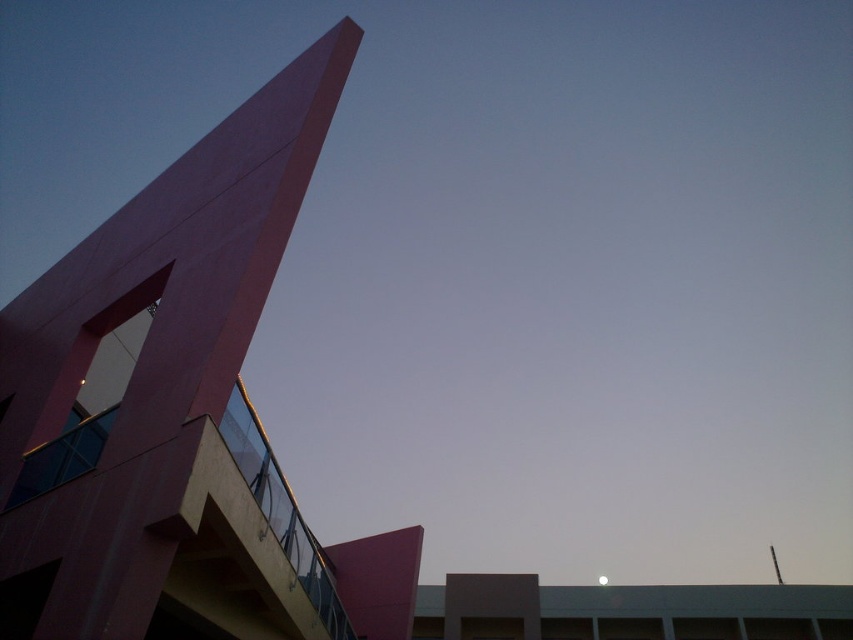
You are an architect evaluating the design of the building. You notice the matte pink tower at upper left and the white glossy moon at upper center. Which object takes up more space in the image?

The white glossy moon at upper center takes up more space in the image because it is larger than the matte pink tower at upper left.

You are standing at the entrance of the building and want to locate the matte pink tower at upper left. According to the coordinates provided, where should you look relative to your current position?

The matte pink tower at upper left is located at coordinates point (167, 401), which means it is positioned to the upper left from your current position at the entrance.